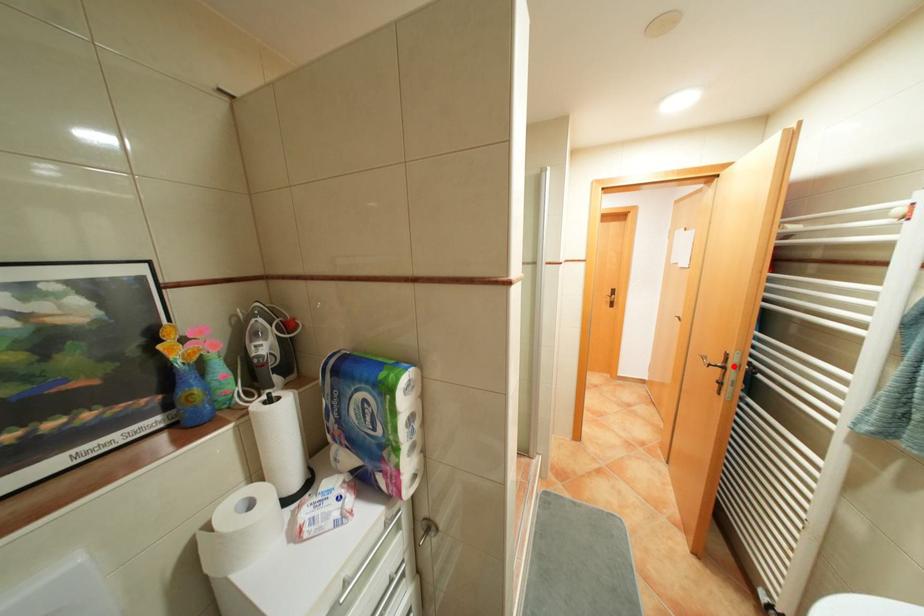
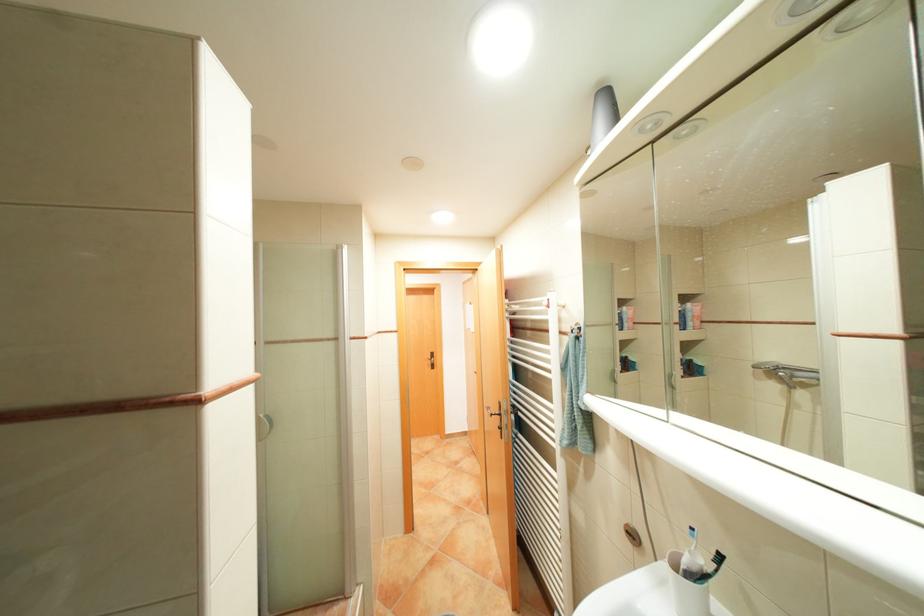
Locate, in the second image, the point that corresponds to the highlighted location in the first image.

(509, 413)